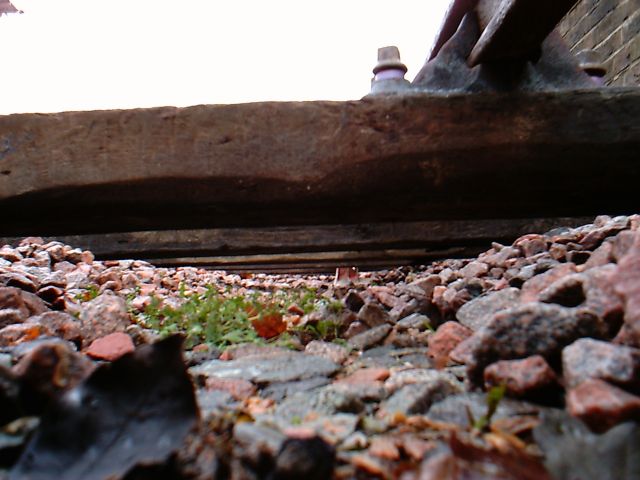
In order to click on wall in this screenshot , I will do `click(225, 240)`.